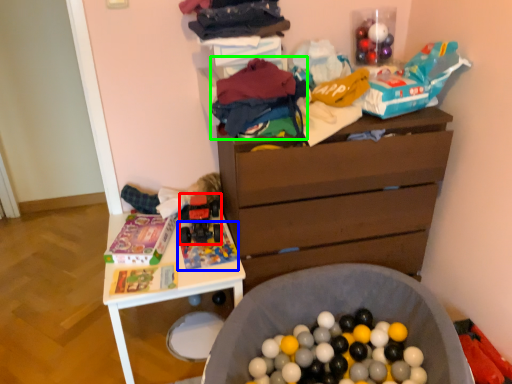
Question: Considering the real-world distances, which object is farthest from toy (highlighted by a red box)? toy (highlighted by a blue box) or clothing (highlighted by a green box)?

Choices:
 (A) toy
 (B) clothing

Answer: (B)